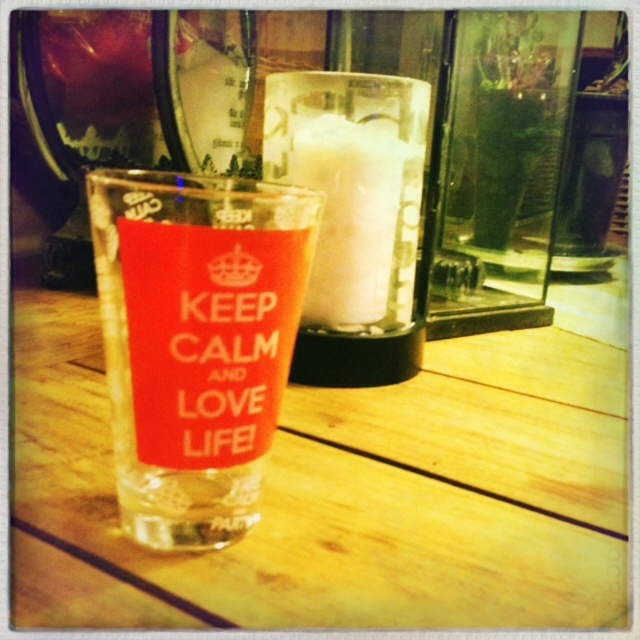
Question: Can you confirm if transparent plastic cup at center is wider than matte orange sign at center?

Choices:
 (A) yes
 (B) no

Answer: (A)

Question: Can you confirm if transparent plastic cup at center is positioned to the right of matte orange sign at center?

Choices:
 (A) no
 (B) yes

Answer: (A)

Question: Which point appears farthest from the camera in this image?

Choices:
 (A) (317, 305)
 (B) (220, 376)
 (C) (248, 436)

Answer: (A)

Question: Among these objects, which one is farthest from the camera?

Choices:
 (A) white frothy milk at center
 (B) matte orange sign at center

Answer: (A)

Question: Considering the relative positions of transparent plastic cup at center and matte orange sign at center in the image provided, where is transparent plastic cup at center located with respect to matte orange sign at center?

Choices:
 (A) left
 (B) right

Answer: (A)

Question: Which point appears closest to the camera in this image?

Choices:
 (A) (256, 301)
 (B) (326, 152)
 (C) (260, 252)

Answer: (C)